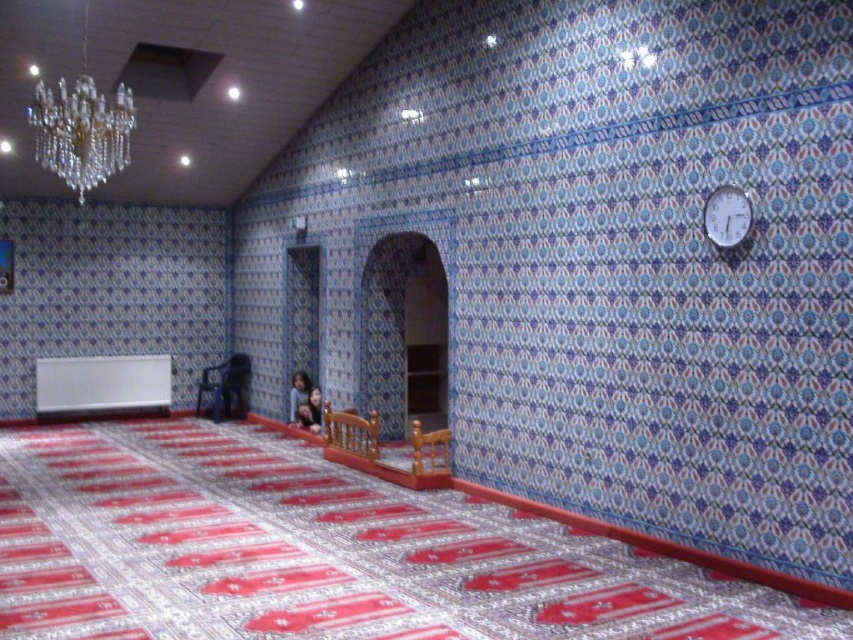
Which is above, white plastic clock at upper right or metallic blue chair at center?

Positioned higher is white plastic clock at upper right.

Identify the location of white plastic clock at upper right. The image size is (853, 640). (727, 216).

You are a GUI agent. You are given a task and a screenshot of the screen. Output one action in this format:
    pyautogui.click(x=<x>, y=<y>)
    Task: Click on the white plastic clock at upper right
    This screenshot has height=640, width=853.
    Given the screenshot: What is the action you would take?
    pyautogui.click(x=727, y=216)

Does crystal glass chandelier at upper left appear over metallic blue chair at center?

Yes.

Between point (70, 144) and point (241, 400), which one is positioned in front?

Point (70, 144)

In order to click on crystal glass chandelier at upper left in this screenshot , I will do `click(80, 131)`.

I want to click on crystal glass chandelier at upper left, so click(x=80, y=131).

Is crystal glass chandelier at upper left positioned before white plastic clock at upper right?

No, it is behind white plastic clock at upper right.

Locate an element on the screen. crystal glass chandelier at upper left is located at coordinates click(80, 131).

Where is `crystal glass chandelier at upper left`? crystal glass chandelier at upper left is located at coordinates (80, 131).